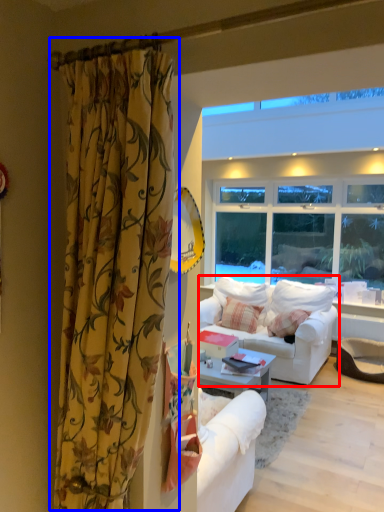
Question: Which of the following is the closest to the observer, studio couch (highlighted by a red box) or curtain (highlighted by a blue box)?

Choices:
 (A) studio couch
 (B) curtain

Answer: (B)